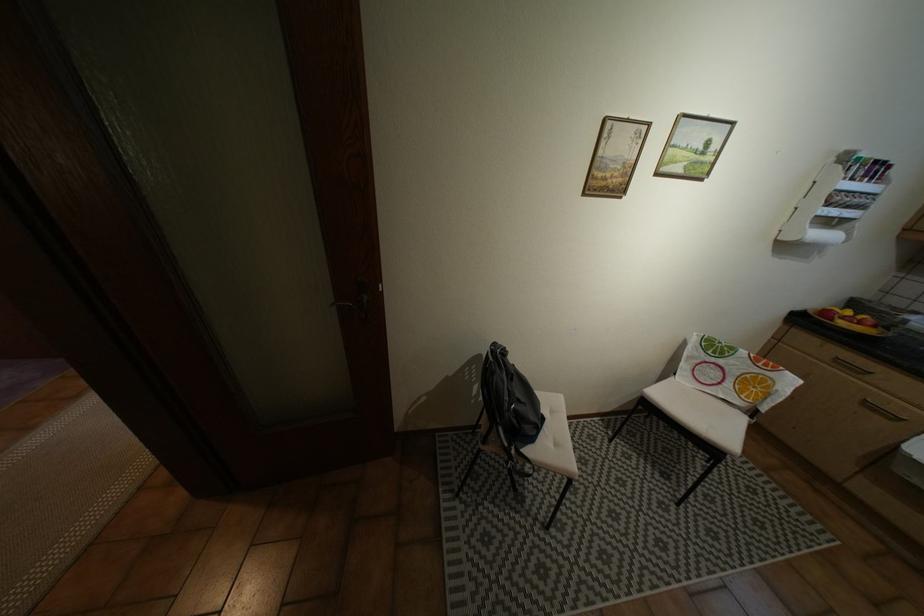
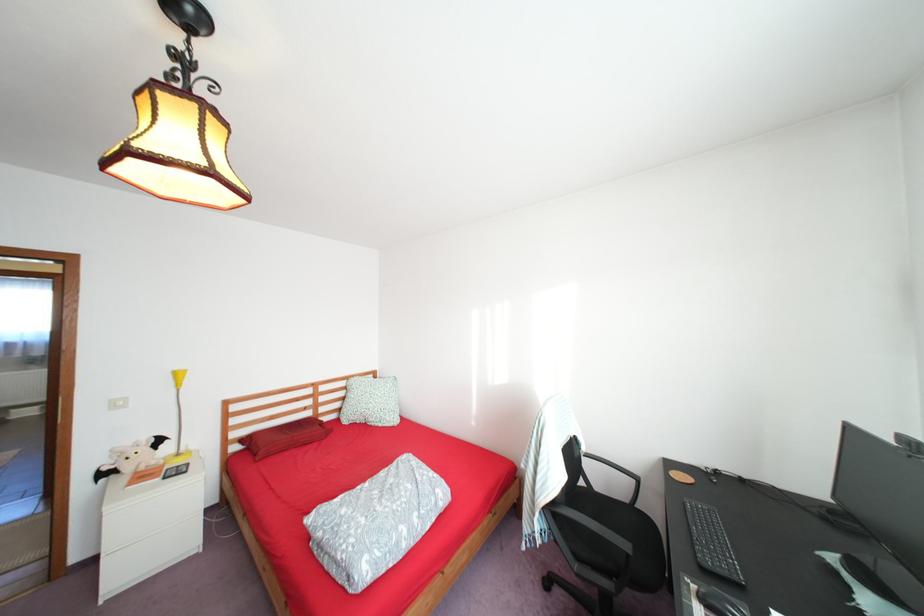
Question: I am providing you with two images of the same scene from different viewpoints. Which of the following objects are not visible in image2?

Choices:
 (A) dark door handle
 (B) black computer mouse
 (C) white patterned holder
 (D) red rectangular pillow

Answer: (A)